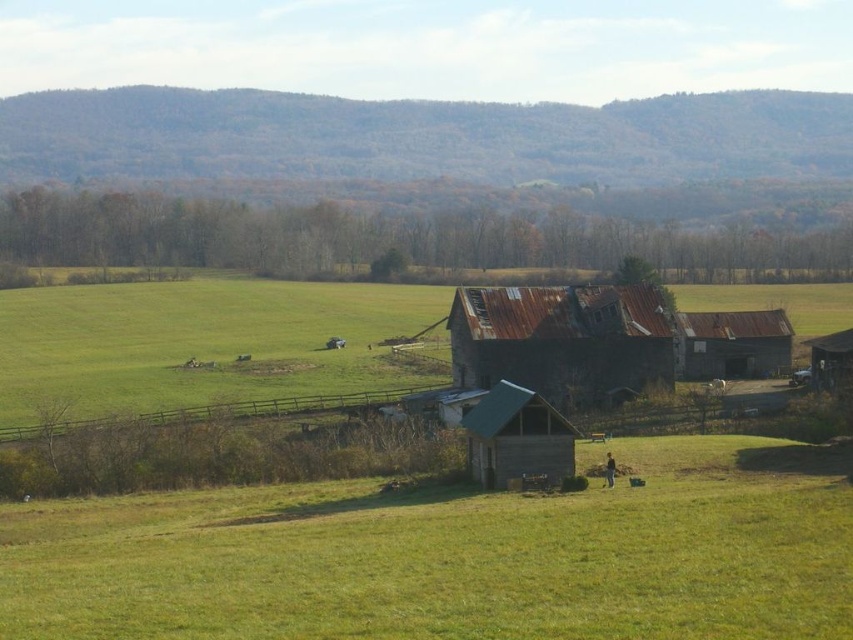
Does rusty metal hut at center appear on the left side of rusty metal barn at center-right?

Indeed, rusty metal hut at center is positioned on the left side of rusty metal barn at center-right.

Who is shorter, rusty metal hut at center or rusty metal barn at center-right?

With less height is rusty metal hut at center.

Where is `rusty metal hut at center`? This screenshot has height=640, width=853. rusty metal hut at center is located at coordinates (515, 436).

Who is positioned more to the right, green grassy field at lower center or rusty metal barn at center?

Positioned to the right is rusty metal barn at center.

Does point (161, 561) come behind point (537, 348)?

No.

This screenshot has width=853, height=640. Find the location of `green grassy field at lower center`. green grassy field at lower center is located at coordinates (454, 556).

What do you see at coordinates (561, 340) in the screenshot?
I see `rusty metal barn at center` at bounding box center [561, 340].

Looking at this image, between rusty metal barn at center and rusty metal barn at center-right, which one has more height?

With more height is rusty metal barn at center.

Is point (469, 291) closer to camera compared to point (782, 364)?

Yes.

What are the coordinates of `rusty metal barn at center` in the screenshot? It's located at (561, 340).